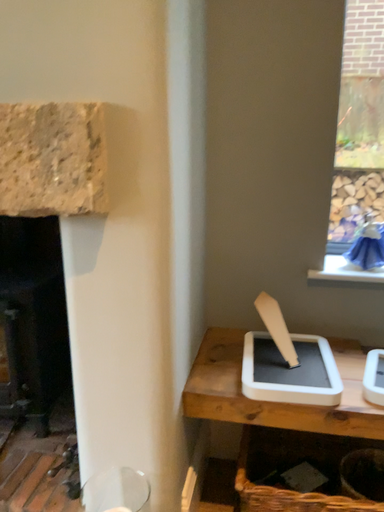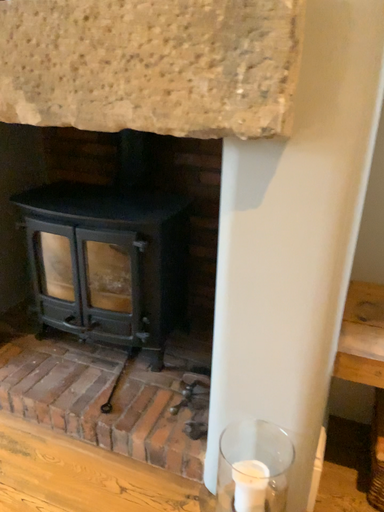
Question: Which way did the camera rotate in the video?

Choices:
 (A) rotated upward
 (B) rotated downward

Answer: (B)